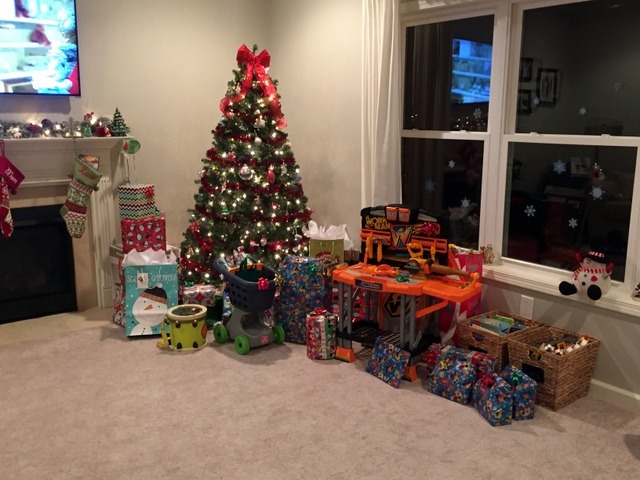
Locate an element on the screen. The image size is (640, 480). unwrapped toys is located at coordinates (252, 298), (393, 280), (195, 330).